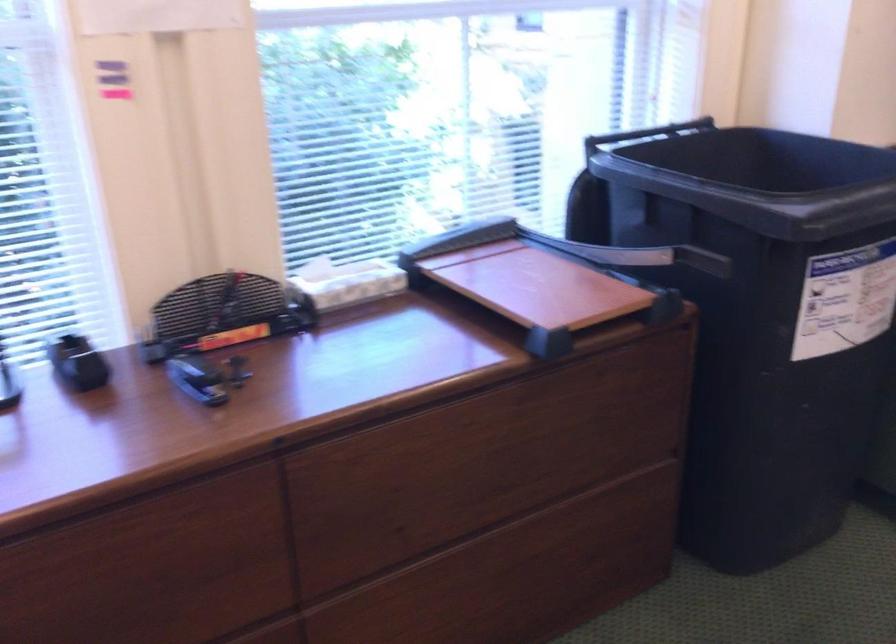
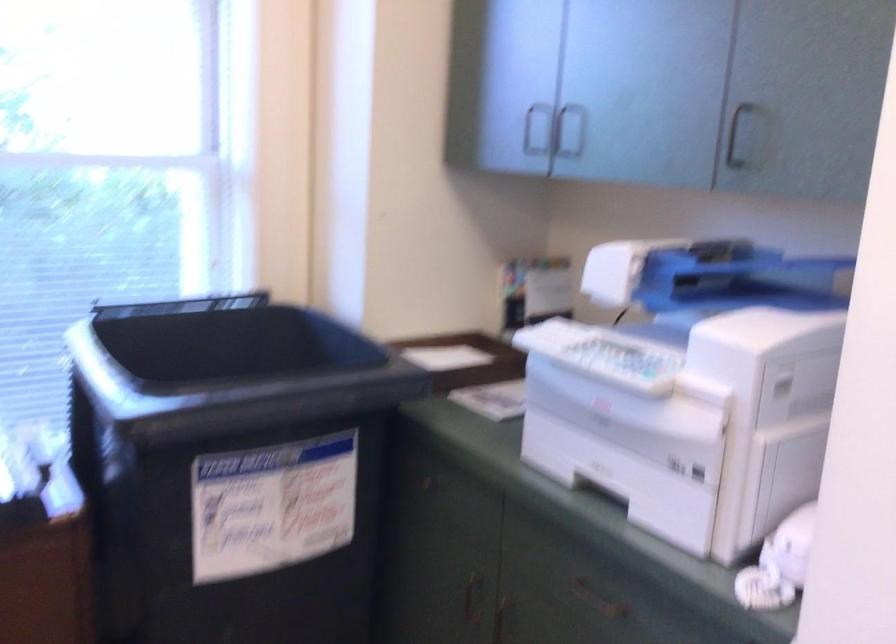
Question: What movement of the cameraman would produce the second image?

Choices:
 (A) Left
 (B) Right
 (C) Forward
 (D) Backward

Answer: (B)